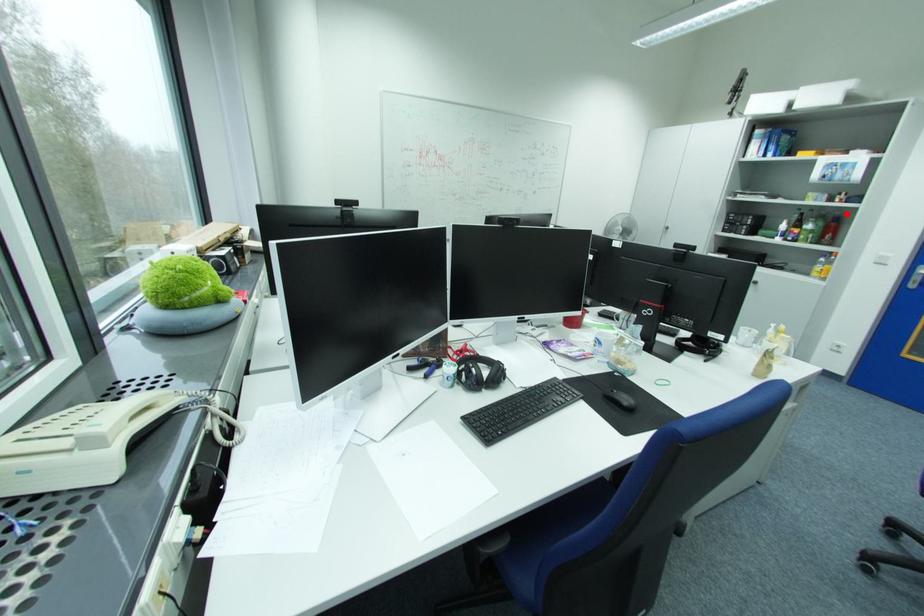
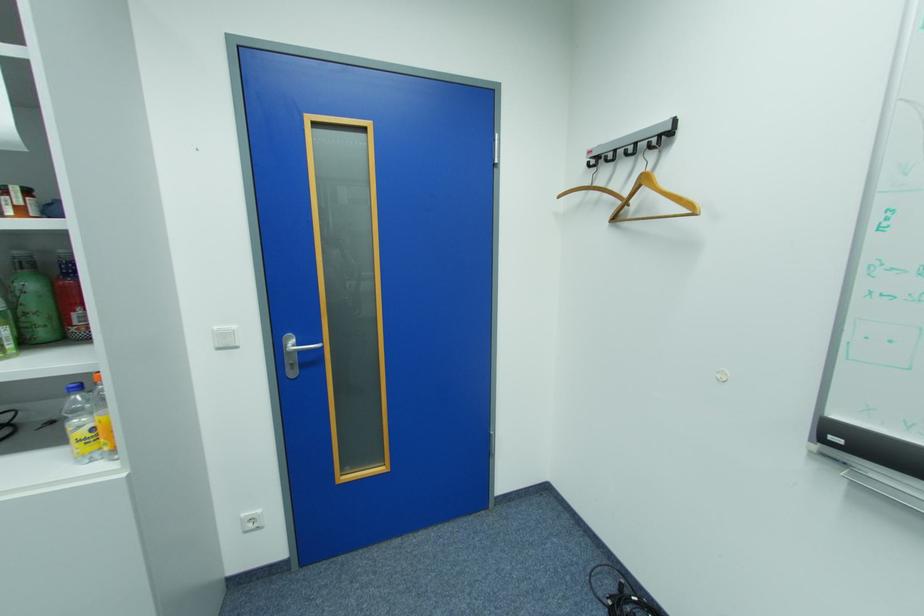
Where in the second image is the point corresponding to the highlighted location from the first image?

(69, 252)